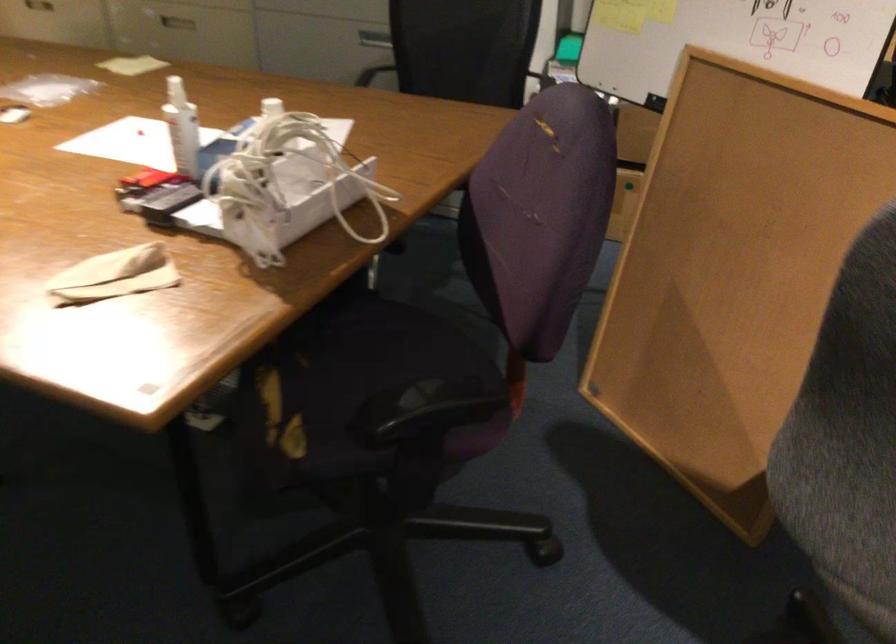
Describe the element at coordinates (418, 413) in the screenshot. I see `a chair sitting surface` at that location.